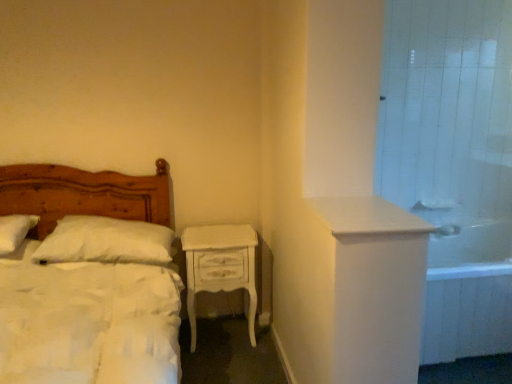
Question: Is wooden bed at left positioned with its back to white soft pillow at left, which appears as the 2th pillow when viewed from the right?

Choices:
 (A) yes
 (B) no

Answer: (A)

Question: Can we say wooden bed at left lies outside white soft pillow at left, which is counted as the first pillow, starting from the left?

Choices:
 (A) yes
 (B) no

Answer: (A)

Question: From the image's perspective, is wooden bed at left over white soft pillow at left, which appears as the 2th pillow when viewed from the right?

Choices:
 (A) yes
 (B) no

Answer: (B)

Question: Can you confirm if wooden bed at left is smaller than white soft pillow at left, which appears as the 2th pillow when viewed from the right?

Choices:
 (A) yes
 (B) no

Answer: (B)

Question: Can you confirm if wooden bed at left is taller than white soft pillow at left, which is counted as the first pillow, starting from the left?

Choices:
 (A) yes
 (B) no

Answer: (A)

Question: From the image's perspective, is wooden bed at left beneath white soft pillow at left, which appears as the 2th pillow when viewed from the right?

Choices:
 (A) no
 (B) yes

Answer: (B)

Question: Considering the relative sizes of wooden bed at left and white tile shower door at upper right in the image provided, is wooden bed at left wider than white tile shower door at upper right?

Choices:
 (A) no
 (B) yes

Answer: (B)

Question: Does wooden bed at left turn towards white tile shower door at upper right?

Choices:
 (A) yes
 (B) no

Answer: (B)

Question: Is wooden bed at left at the right side of white tile shower door at upper right?

Choices:
 (A) yes
 (B) no

Answer: (B)

Question: Is wooden bed at left at the left side of white tile shower door at upper right?

Choices:
 (A) no
 (B) yes

Answer: (B)

Question: Would you say wooden bed at left is a long distance from white tile shower door at upper right?

Choices:
 (A) yes
 (B) no

Answer: (A)

Question: Is wooden bed at left closer to the viewer compared to white tile shower door at upper right?

Choices:
 (A) no
 (B) yes

Answer: (B)

Question: Considering the relative sizes of white painted wood nightstand at center and white glossy sink at upper right in the image provided, is white painted wood nightstand at center bigger than white glossy sink at upper right?

Choices:
 (A) yes
 (B) no

Answer: (A)